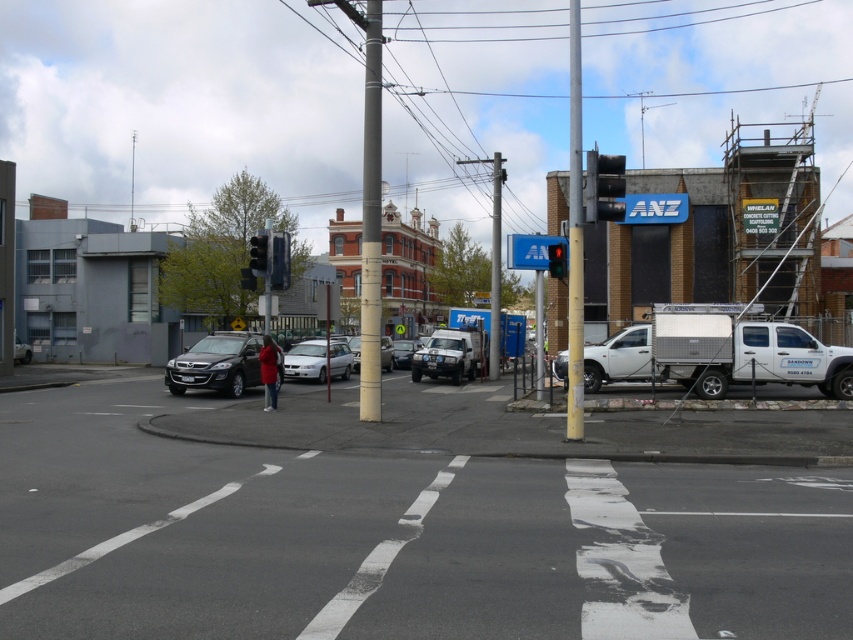
Does metallic gray pole at center have a larger size compared to silver metallic sedan at center?

Yes, metallic gray pole at center is bigger than silver metallic sedan at center.

Is metallic gray pole at center positioned before silver metallic sedan at center?

That is True.

Which is behind, point (572, 243) or point (357, 349)?

Positioned behind is point (357, 349).

Image resolution: width=853 pixels, height=640 pixels. In order to click on metallic gray pole at center in this screenshot , I will do `click(575, 237)`.

Is blue plastic sign at center taller than matte black sedan at left?

Yes.

Locate an element on the screen. blue plastic sign at center is located at coordinates (531, 250).

Identify the location of blue plastic sign at center. (531, 250).

What do you see at coordinates (531, 250) in the screenshot? The image size is (853, 640). I see `blue plastic sign at center` at bounding box center [531, 250].

Who is more forward, (532, 260) or (271, 262)?

Point (271, 262) is in front.

This screenshot has height=640, width=853. Describe the element at coordinates (531, 250) in the screenshot. I see `blue plastic sign at center` at that location.

At what (x,y) coordinates should I click in order to perform the action: click on blue plastic sign at center. Please return your answer as a coordinate pair (x, y). The height and width of the screenshot is (640, 853). Looking at the image, I should click on (531, 250).